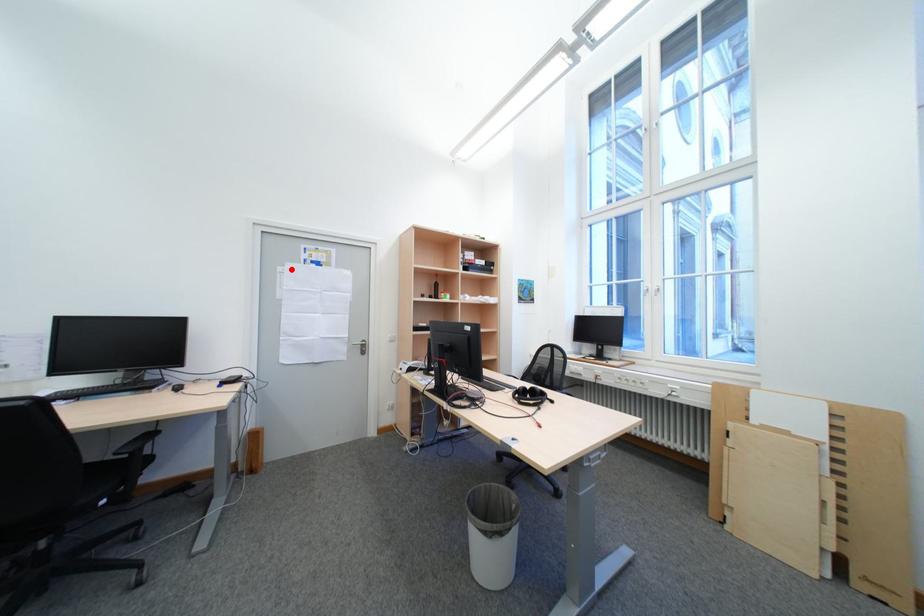
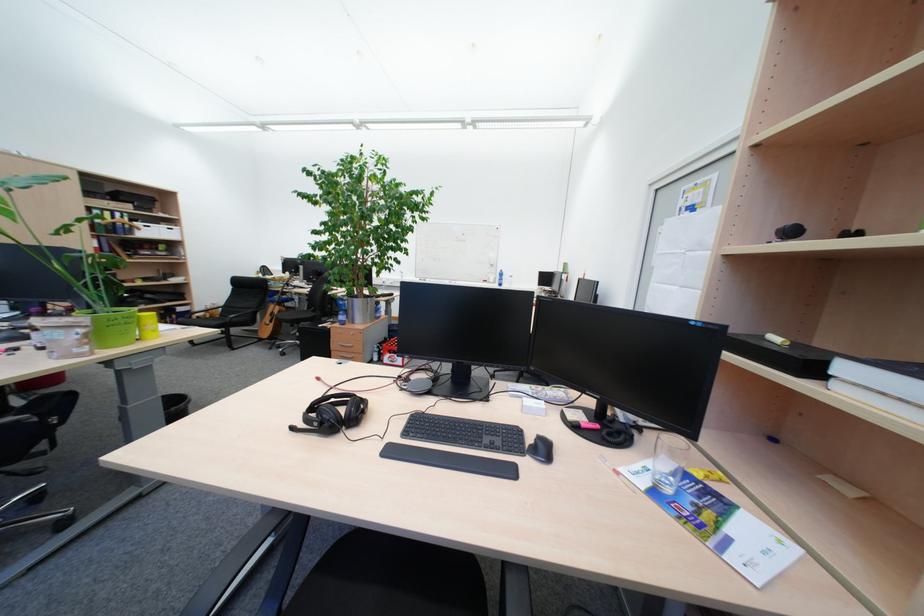
The point at the highlighted location is marked in the first image. Where is the corresponding point in the second image?

(671, 230)